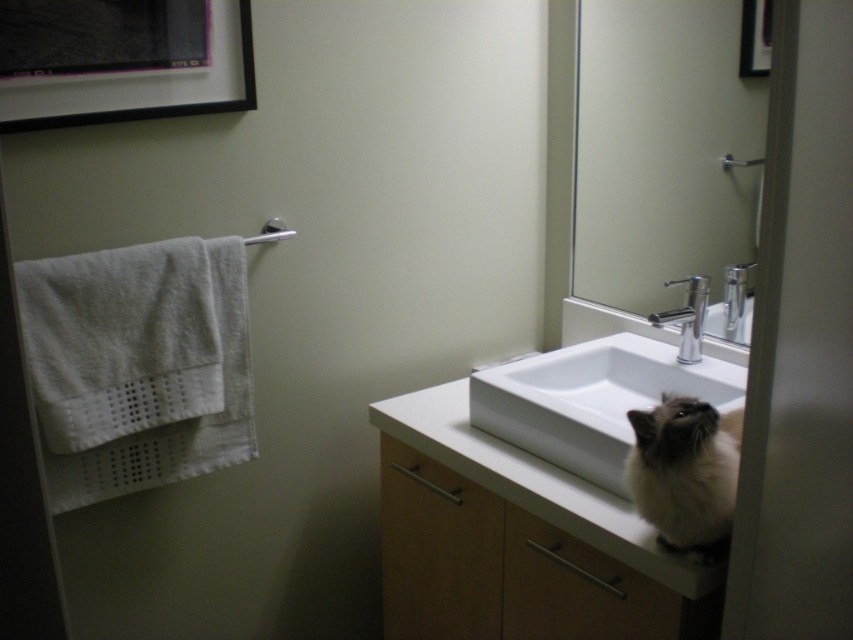
Question: Which point is closer to the camera taking this photo?

Choices:
 (A) (674, 460)
 (B) (83, 122)
 (C) (560, 428)
 (D) (749, 48)

Answer: (A)

Question: Which point appears farthest from the camera in this image?

Choices:
 (A) (614, 577)
 (B) (277, 237)

Answer: (B)

Question: Does silver metallic faucet at sink right appear under silver metallic towel bar at upper left?

Choices:
 (A) yes
 (B) no

Answer: (A)

Question: Does white fluffy cat at lower right come in front of silver metallic towel bar at upper left?

Choices:
 (A) no
 (B) yes

Answer: (B)

Question: Which of the following is the closest to the observer?

Choices:
 (A) silver metallic faucet at upper right
 (B) black glossy picture frame at upper right
 (C) black matte picture frame at upper left

Answer: (C)

Question: Does black matte picture frame at upper left lie behind silver metallic faucet at sink right?

Choices:
 (A) yes
 (B) no

Answer: (B)